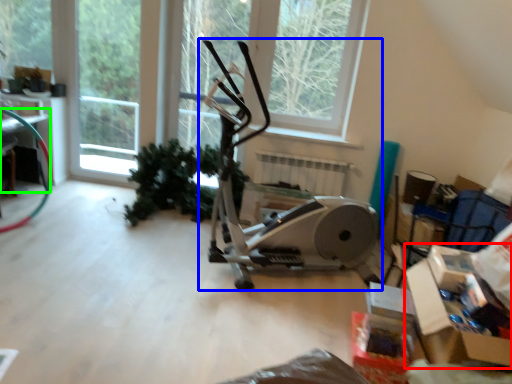
Question: Based on their relative distances, which object is nearer to cardboard box (highlighted by a red box)? Choose from stationary bicycle (highlighted by a blue box) and table (highlighted by a green box).

Choices:
 (A) stationary bicycle
 (B) table

Answer: (A)